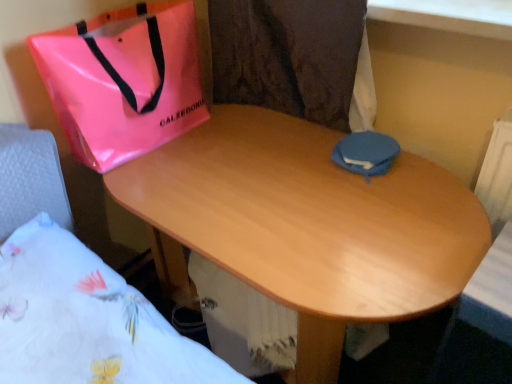
Question: Is pink glossy bag at upper left situated inside blue fabric pouch at center or outside?

Choices:
 (A) outside
 (B) inside

Answer: (A)

Question: Is pink glossy bag at upper left bigger or smaller than blue fabric pouch at center?

Choices:
 (A) small
 (B) big

Answer: (B)

Question: Which object is positioned closest to the white floral fabric at lower left?

Choices:
 (A) blue fabric pouch at center
 (B) wooden desk at center
 (C) pink glossy bag at upper left

Answer: (C)

Question: Which object is positioned farthest from the blue fabric pouch at center?

Choices:
 (A) white floral fabric at lower left
 (B) pink glossy bag at upper left
 (C) wooden desk at center

Answer: (A)